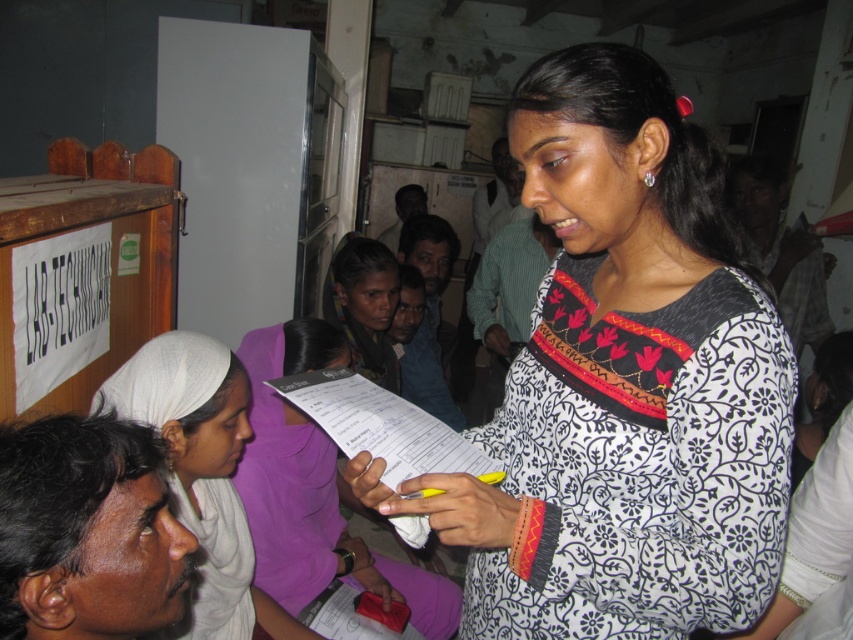
Question: Is white printed dress at center above white paper at center?

Choices:
 (A) no
 (B) yes

Answer: (B)

Question: Which of the following is the closest to the observer?

Choices:
 (A) (769, 296)
 (B) (260, 580)
 (C) (164, 332)

Answer: (A)

Question: Which of these objects is positioned farthest from the dark purple fabric at center?

Choices:
 (A) white fabric headscarf at left
 (B) white printed paper at center

Answer: (A)

Question: From the image, what is the correct spatial relationship of white printed paper at center in relation to white fabric headscarf at left?

Choices:
 (A) below
 (B) above

Answer: (A)

Question: Observing the image, what is the correct spatial positioning of white printed dress at center in reference to dark purple fabric at center?

Choices:
 (A) above
 (B) below

Answer: (B)

Question: Which object is the farthest from the dark purple fabric at center?

Choices:
 (A) white paper at center
 (B) white printed paper at center
 (C) white fabric headscarf at left

Answer: (A)